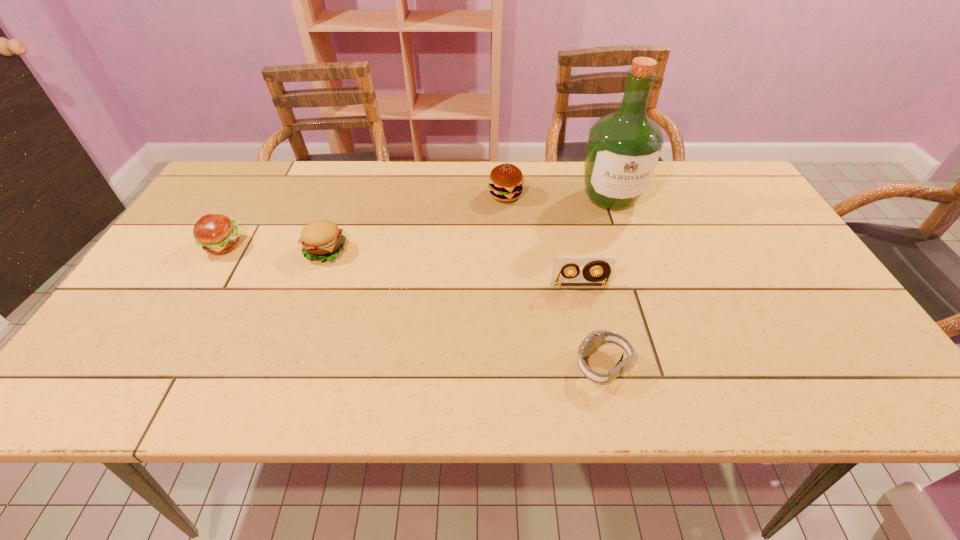
Where is `free space that is in between the leftmost hamburger and the liquor`? The height and width of the screenshot is (540, 960). free space that is in between the leftmost hamburger and the liquor is located at coordinates (417, 222).

Image resolution: width=960 pixels, height=540 pixels. Identify the location of vacant area that lies between the second object from left to right and the fourth object from right to left. (416, 222).

Identify the location of object that ranks as the second closest to the tallest object. (605, 265).

Find the location of a particular element. the fifth closest object to the fifth farthest object is located at coordinates (217, 234).

Locate an element on the screen. hamburger that stands as the third closest to the liquor is located at coordinates (217, 234).

Find the location of a particular element. This screenshot has width=960, height=540. hamburger that is the second closest to the liquor is located at coordinates (322, 240).